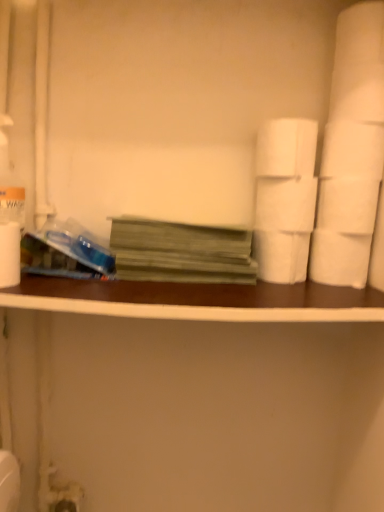
Locate an element on the screen. Image resolution: width=384 pixels, height=512 pixels. white matte toilet paper at right, which is the 3th toilet paper in bottom-to-top order is located at coordinates (347, 205).

The width and height of the screenshot is (384, 512). What are the coordinates of `brown wood ledge at center` in the screenshot? It's located at (198, 300).

What do you see at coordinates (9, 254) in the screenshot?
I see `white matte paper towel at left` at bounding box center [9, 254].

At what (x,y) coordinates should I click in order to perform the action: click on white matte toilet paper at right, arranged as the first toilet paper when ordered from the bottom. Please return your answer as a coordinate pair (x, y). Looking at the image, I should click on (339, 258).

I want to click on green matte book at center, so click(x=181, y=252).

Where is `white matte toilet paper at upper right, which is the first toilet paper in top-to-bottom order`? Image resolution: width=384 pixels, height=512 pixels. white matte toilet paper at upper right, which is the first toilet paper in top-to-bottom order is located at coordinates (286, 148).

From the image's perspective, relative to green matte book at center, is white matte toilet paper at center right, the second toilet paper when ordered from top to bottom, above or below?

Based on their image positions, white matte toilet paper at center right, the second toilet paper when ordered from top to bottom, is located above green matte book at center.

Considering the positions of point (293, 209) and point (174, 245), is point (293, 209) closer or farther from the camera than point (174, 245)?

Point (293, 209) is farther from the camera than point (174, 245).

Which object is positioned more to the left, white matte toilet paper at center right, the second toilet paper when ordered from top to bottom, or green matte book at center?

green matte book at center.

Could you measure the distance between white matte toilet paper at center right, the fourth toilet paper ordered from the bottom, and green matte book at center?

5.58 inches.

Is white matte toilet paper at right, the 5th toilet paper when ordered from top to bottom, beside white matte toilet paper at right, acting as the third toilet paper starting from the top?

Yes, white matte toilet paper at right, the 5th toilet paper when ordered from top to bottom, is touching white matte toilet paper at right, acting as the third toilet paper starting from the top.

Is white matte toilet paper at right, the 5th toilet paper when ordered from top to bottom, closer to the viewer compared to white matte toilet paper at right, acting as the third toilet paper starting from the top?

No, the depth of white matte toilet paper at right, the 5th toilet paper when ordered from top to bottom, is greater than that of white matte toilet paper at right, acting as the third toilet paper starting from the top.

Considering the relative sizes of white matte toilet paper at right, arranged as the first toilet paper when ordered from the bottom, and white matte toilet paper at right, acting as the third toilet paper starting from the top, in the image provided, is white matte toilet paper at right, arranged as the first toilet paper when ordered from the bottom, shorter than white matte toilet paper at right, acting as the third toilet paper starting from the top,?

In fact, white matte toilet paper at right, arranged as the first toilet paper when ordered from the bottom, may be taller than white matte toilet paper at right, acting as the third toilet paper starting from the top.

Looking at this image, is white matte toilet paper at right, acting as the third toilet paper starting from the top, far from green matte book at center?

No.

From the image's perspective, is white matte toilet paper at right, acting as the third toilet paper starting from the top, on top of green matte book at center?

Yes.

Is point (353, 182) positioned behind point (182, 246)?

No, it is not.

From the picture: How different are the orientations of white matte toilet paper at right, which is the 3th toilet paper in bottom-to-top order, and green matte book at center in degrees?

0.367 degrees.

From a real-world perspective, who is located lower, green matte book at center or white matte toilet paper at right, the second toilet paper ordered from the bottom?

white matte toilet paper at right, the second toilet paper ordered from the bottom, from a real-world perspective.

Is green matte book at center surrounding white matte toilet paper at right, the second toilet paper ordered from the bottom?

No, white matte toilet paper at right, the second toilet paper ordered from the bottom, is not a part of green matte book at center.

Is green matte book at center facing towards white matte toilet paper at right, arranged as the 4th toilet paper when viewed from the top?

No.

Which is closer, (142, 230) or (287, 265)?

Point (142, 230).

Is brown wood ledge at center behind white matte toilet paper at upper right, the fifth toilet paper when ordered from bottom to top?

No, the depth of brown wood ledge at center is less than that of white matte toilet paper at upper right, the fifth toilet paper when ordered from bottom to top.

Is white matte toilet paper at upper right, the fifth toilet paper when ordered from bottom to top, at the back of brown wood ledge at center?

No, white matte toilet paper at upper right, the fifth toilet paper when ordered from bottom to top, is not at the back of brown wood ledge at center.

Who is bigger, brown wood ledge at center or white matte toilet paper at upper right, which is the first toilet paper in top-to-bottom order?

With larger size is brown wood ledge at center.

Could you measure the distance between brown wood ledge at center and white matte toilet paper at upper right, which is the first toilet paper in top-to-bottom order?

brown wood ledge at center and white matte toilet paper at upper right, which is the first toilet paper in top-to-bottom order, are 11.22 inches apart.

Is white matte toilet paper at upper right, which is the first toilet paper in top-to-bottom order, not near brown wood ledge at center?

No.

Is white matte toilet paper at upper right, which is the first toilet paper in top-to-bottom order, turned away from brown wood ledge at center?

No, white matte toilet paper at upper right, which is the first toilet paper in top-to-bottom order, is not facing away from brown wood ledge at center.

From the image's perspective, would you say white matte toilet paper at upper right, which is the first toilet paper in top-to-bottom order, is shown under brown wood ledge at center?

No, from the image's perspective, white matte toilet paper at upper right, which is the first toilet paper in top-to-bottom order, is not below brown wood ledge at center.

Who is bigger, white matte toilet paper at upper right, which is the first toilet paper in top-to-bottom order, or brown wood ledge at center?

With larger size is brown wood ledge at center.

Is white matte toilet paper at upper right, which is the first toilet paper in top-to-bottom order, oriented towards white matte toilet paper at right, the 5th toilet paper when ordered from top to bottom?

No, white matte toilet paper at upper right, which is the first toilet paper in top-to-bottom order, is not aimed at white matte toilet paper at right, the 5th toilet paper when ordered from top to bottom.

Which is more to the right, white matte toilet paper at upper right, the fifth toilet paper when ordered from bottom to top, or white matte toilet paper at right, the 5th toilet paper when ordered from top to bottom?

Positioned to the right is white matte toilet paper at right, the 5th toilet paper when ordered from top to bottom.

Who is taller, white matte toilet paper at upper right, the fifth toilet paper when ordered from bottom to top, or white matte toilet paper at right, the 5th toilet paper when ordered from top to bottom?

white matte toilet paper at right, the 5th toilet paper when ordered from top to bottom, is taller.

Choose the correct answer: Is white matte toilet paper at upper right, which is the first toilet paper in top-to-bottom order, inside white matte toilet paper at right, arranged as the first toilet paper when ordered from the bottom, or outside it?

white matte toilet paper at upper right, which is the first toilet paper in top-to-bottom order, is not inside white matte toilet paper at right, arranged as the first toilet paper when ordered from the bottom, it's outside.

At what (x,y) coordinates should I click in order to perform the action: click on toilet paper that is the 1st object located behind the green matte book at center. Please return your answer as a coordinate pair (x, y). The height and width of the screenshot is (512, 384). Looking at the image, I should click on (285, 204).

Starting from the white matte toilet paper at right, arranged as the first toilet paper when ordered from the bottom, which toilet paper is the 2nd one in front? Please provide its 2D coordinates.

[(347, 205)]

Based on their spatial positions, is white matte toilet paper at right, the second toilet paper ordered from the bottom, or brown wood ledge at center further from white matte paper towel at left?

white matte toilet paper at right, the second toilet paper ordered from the bottom, lies further to white matte paper towel at left than the other object.

Looking at the image, which one is located closer to white matte toilet paper at upper right, the fifth toilet paper when ordered from bottom to top, white matte paper towel at left or white matte toilet paper at right, which is the 3th toilet paper in bottom-to-top order?

white matte toilet paper at right, which is the 3th toilet paper in bottom-to-top order, lies closer to white matte toilet paper at upper right, the fifth toilet paper when ordered from bottom to top, than the other object.

Which object lies nearer to the anchor point white matte toilet paper at center right, the second toilet paper when ordered from top to bottom, white matte toilet paper at right, arranged as the 4th toilet paper when viewed from the top, or white matte toilet paper at right, arranged as the first toilet paper when ordered from the bottom?

white matte toilet paper at right, arranged as the 4th toilet paper when viewed from the top, is closer to white matte toilet paper at center right, the second toilet paper when ordered from top to bottom.

Which object lies further to the anchor point white matte toilet paper at center right, the second toilet paper when ordered from top to bottom, brown wood ledge at center or green matte book at center?

brown wood ledge at center is positioned further to the anchor white matte toilet paper at center right, the second toilet paper when ordered from top to bottom.

When comparing their distances from white matte toilet paper at upper right, which is the first toilet paper in top-to-bottom order, does green matte book at center or white matte toilet paper at center right, the second toilet paper when ordered from top to bottom, seem further?

green matte book at center lies further to white matte toilet paper at upper right, which is the first toilet paper in top-to-bottom order, than the other object.

From the image, which object appears to be farther from brown wood ledge at center, white matte toilet paper at right, arranged as the first toilet paper when ordered from the bottom, or white matte toilet paper at center right, the fourth toilet paper ordered from the bottom?

Based on the image, white matte toilet paper at right, arranged as the first toilet paper when ordered from the bottom, appears to be further to brown wood ledge at center.

Based on their spatial positions, is white matte toilet paper at right, acting as the third toilet paper starting from the top, or white matte paper towel at left closer to white matte toilet paper at right, the second toilet paper ordered from the bottom?

white matte toilet paper at right, acting as the third toilet paper starting from the top, lies closer to white matte toilet paper at right, the second toilet paper ordered from the bottom, than the other object.

From the image, which object appears to be farther from brown wood ledge at center, white matte toilet paper at right, the 5th toilet paper when ordered from top to bottom, or white matte toilet paper at upper right, the fifth toilet paper when ordered from bottom to top?

Based on the image, white matte toilet paper at upper right, the fifth toilet paper when ordered from bottom to top, appears to be further to brown wood ledge at center.

In order to click on ledge situated between white matte paper towel at left and green matte book at center from left to right in this screenshot , I will do `click(198, 300)`.

The height and width of the screenshot is (512, 384). Identify the location of book between white matte paper towel at left and white matte toilet paper at center right, the fourth toilet paper ordered from the bottom, from left to right. (181, 252).

The width and height of the screenshot is (384, 512). I want to click on book located between brown wood ledge at center and white matte toilet paper at right, the 5th toilet paper when ordered from top to bottom, in the left-right direction, so click(181, 252).

This screenshot has width=384, height=512. I want to click on ledge situated between white matte paper towel at left and white matte toilet paper at center right, the second toilet paper when ordered from top to bottom, from left to right, so click(x=198, y=300).